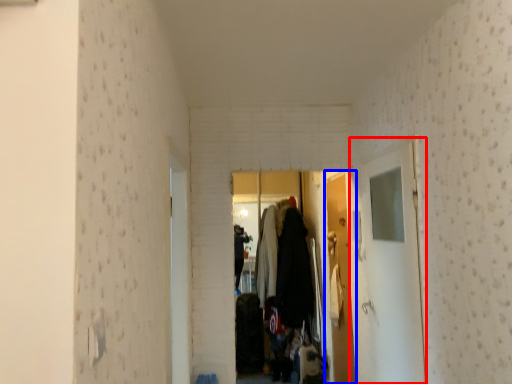
Question: Which of the following is the farthest to the observer, glass door (highlighted by a red box) or door (highlighted by a blue box)?

Choices:
 (A) glass door
 (B) door

Answer: (B)